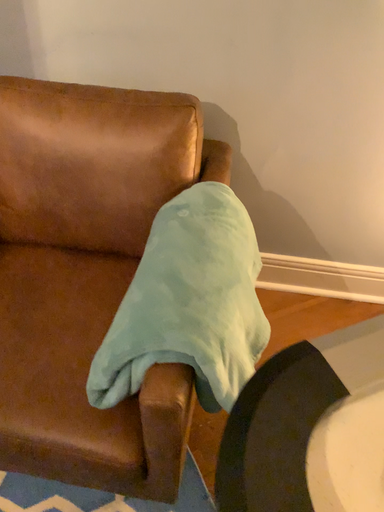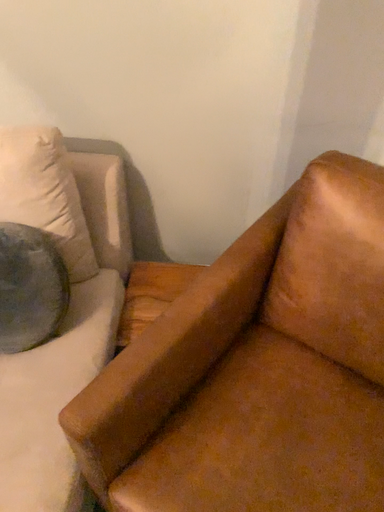
Question: Which way did the camera rotate in the video?

Choices:
 (A) rotated right
 (B) rotated left

Answer: (B)